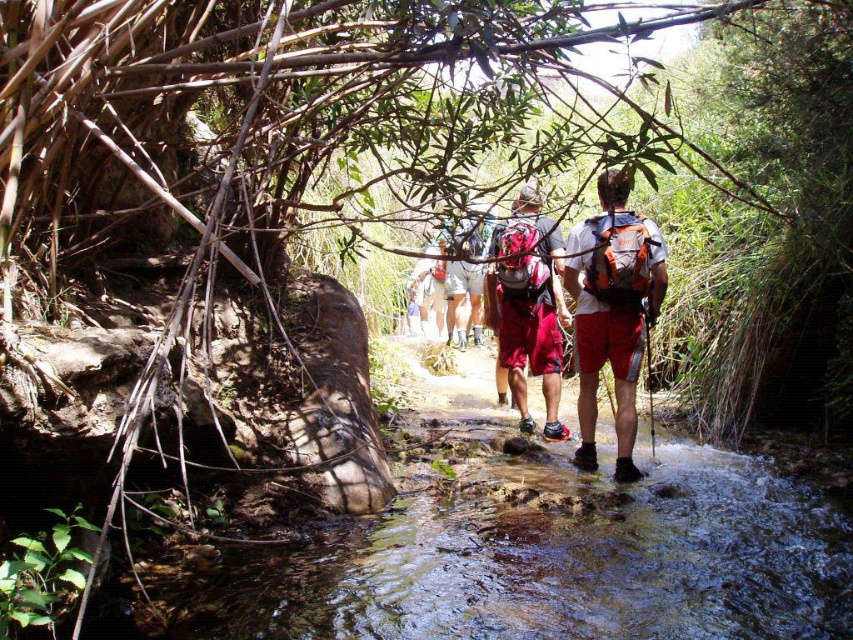
Question: Among these objects, which one is nearest to the camera?

Choices:
 (A) matte red shorts at center
 (B) matte orange backpack at center

Answer: (B)

Question: Which point appears farthest from the camera in this image?

Choices:
 (A) (611, 368)
 (B) (521, 417)

Answer: (B)

Question: Is matte orange backpack at center above matte red shorts at center?

Choices:
 (A) no
 (B) yes

Answer: (A)

Question: Is matte orange backpack at center to the left of matte red shorts at center from the viewer's perspective?

Choices:
 (A) no
 (B) yes

Answer: (A)

Question: Which point is farther to the camera?

Choices:
 (A) (508, 355)
 (B) (628, 177)

Answer: (A)

Question: Can you confirm if matte orange backpack at center is positioned to the left of matte red shorts at center?

Choices:
 (A) yes
 (B) no

Answer: (B)